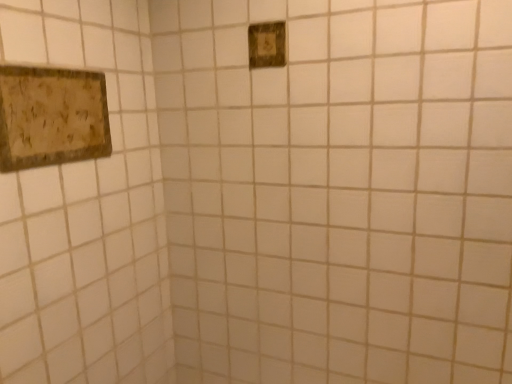
Find the location of a particular element. The width and height of the screenshot is (512, 384). wooden textured picture frame at upper left is located at coordinates (51, 117).

In order to face wooden textured picture frame at upper left, should I rotate leftwards or rightwards?

To face it directly, rotate left by 24.233 degrees.

From the picture: What is the approximate width of wooden textured picture frame at upper left?

It is 1.82 inches.

This screenshot has width=512, height=384. Describe the element at coordinates (51, 117) in the screenshot. I see `wooden textured picture frame at upper left` at that location.

The width and height of the screenshot is (512, 384). What do you see at coordinates (267, 45) in the screenshot?
I see `green textured switch at upper center` at bounding box center [267, 45].

You are a GUI agent. You are given a task and a screenshot of the screen. Output one action in this format:
    pyautogui.click(x=<x>, y=<y>)
    Task: Click on the green textured switch at upper center
    This screenshot has height=384, width=512.
    Given the screenshot: What is the action you would take?
    pyautogui.click(x=267, y=45)

The height and width of the screenshot is (384, 512). I want to click on wooden textured picture frame at upper left, so coord(51,117).

Which object is positioned more to the right, wooden textured picture frame at upper left or green textured switch at upper center?

From the viewer's perspective, green textured switch at upper center appears more on the right side.

In the image, is wooden textured picture frame at upper left positioned in front of or behind green textured switch at upper center?

wooden textured picture frame at upper left is in front of green textured switch at upper center.

Considering the positions of points (104, 128) and (284, 48), is point (104, 128) closer to camera compared to point (284, 48)?

Yes, point (104, 128) is in front of point (284, 48).

From the image's perspective, does wooden textured picture frame at upper left appear lower than green textured switch at upper center?

Yes.

From a real-world perspective, relative to green textured switch at upper center, is wooden textured picture frame at upper left vertically above or below?

In terms of real-world spatial position, wooden textured picture frame at upper left is below green textured switch at upper center.

Can you confirm if wooden textured picture frame at upper left is wider than green textured switch at upper center?

Correct, the width of wooden textured picture frame at upper left exceeds that of green textured switch at upper center.

Considering the sizes of objects wooden textured picture frame at upper left and green textured switch at upper center in the image provided, who is taller, wooden textured picture frame at upper left or green textured switch at upper center?

With more height is wooden textured picture frame at upper left.

Between wooden textured picture frame at upper left and green textured switch at upper center, which one has smaller size?

Smaller between the two is green textured switch at upper center.

Is wooden textured picture frame at upper left surrounding green textured switch at upper center?

No, green textured switch at upper center is not surrounded by wooden textured picture frame at upper left.

Looking at this image, are wooden textured picture frame at upper left and green textured switch at upper center beside each other?

No, wooden textured picture frame at upper left is not beside green textured switch at upper center.

Is wooden textured picture frame at upper left facing away from green textured switch at upper center?

No.

Identify the location of light switch above the wooden textured picture frame at upper left (from a real-world perspective). (267, 45).

Considering the relative positions of green textured switch at upper center and wooden textured picture frame at upper left in the image provided, is green textured switch at upper center to the left of wooden textured picture frame at upper left from the viewer's perspective?

No, green textured switch at upper center is not to the left of wooden textured picture frame at upper left.

Does green textured switch at upper center lie behind wooden textured picture frame at upper left?

Yes, green textured switch at upper center is further from the camera.

Does point (272, 49) lie behind point (16, 128)?

Yes, point (272, 49) is farther from viewer.

From the image's perspective, which object appears higher, green textured switch at upper center or wooden textured picture frame at upper left?

From the image's view, green textured switch at upper center is above.

From a real-world perspective, who is located higher, green textured switch at upper center or wooden textured picture frame at upper left?

green textured switch at upper center.

Looking at their sizes, would you say green textured switch at upper center is wider or thinner than wooden textured picture frame at upper left?

green textured switch at upper center is thinner than wooden textured picture frame at upper left.

Considering the sizes of objects green textured switch at upper center and wooden textured picture frame at upper left in the image provided, who is taller, green textured switch at upper center or wooden textured picture frame at upper left?

With more height is wooden textured picture frame at upper left.

Can you confirm if green textured switch at upper center is smaller than wooden textured picture frame at upper left?

Correct, green textured switch at upper center occupies less space than wooden textured picture frame at upper left.

Looking at this image, could wooden textured picture frame at upper left be considered to be inside green textured switch at upper center?

No, green textured switch at upper center does not contain wooden textured picture frame at upper left.

Is there a large distance between green textured switch at upper center and wooden textured picture frame at upper left?

Actually, green textured switch at upper center and wooden textured picture frame at upper left are a little close together.

Is green textured switch at upper center facing away from wooden textured picture frame at upper left?

No, green textured switch at upper center is not facing the opposite direction of wooden textured picture frame at upper left.

How different are the orientations of green textured switch at upper center and wooden textured picture frame at upper left in degrees?

The facing directions of green textured switch at upper center and wooden textured picture frame at upper left are 90 degrees apart.

At what (x,y) coordinates should I click in order to perform the action: click on light switch above the wooden textured picture frame at upper left (from the image's perspective). Please return your answer as a coordinate pair (x, y). The width and height of the screenshot is (512, 384). Looking at the image, I should click on (267, 45).

Identify the location of light switch located above the wooden textured picture frame at upper left (from a real-world perspective). Image resolution: width=512 pixels, height=384 pixels. (267, 45).

At what (x,y) coordinates should I click in order to perform the action: click on picture frame below the green textured switch at upper center (from the image's perspective). Please return your answer as a coordinate pair (x, y). Looking at the image, I should click on (51, 117).